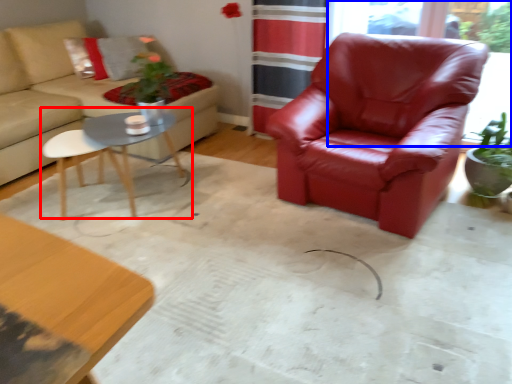
Question: Among these objects, which one is farthest to the camera, coffee table (highlighted by a red box) or window screen (highlighted by a blue box)?

Choices:
 (A) coffee table
 (B) window screen

Answer: (B)